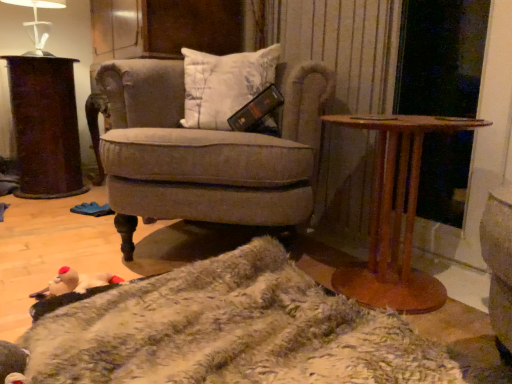
Question: In terms of width, does fuzzy beige blanket at lower center look wider or thinner when compared to dark brown polished wood desk at left?

Choices:
 (A) wide
 (B) thin

Answer: (A)

Question: Is fuzzy beige blanket at lower center in front of or behind dark brown polished wood desk at left in the image?

Choices:
 (A) front
 (B) behind

Answer: (A)

Question: Which of these objects is positioned closest to the velvet beige armchair at center?

Choices:
 (A) fuzzy beige blanket at lower center
 (B) white glossy table lamp at upper left
 (C) brown wood table at right
 (D) white cotton pillow at center
 (E) dark brown polished wood desk at left

Answer: (D)

Question: Estimate the real-world distances between objects in this image. Which object is closer to the white cotton pillow at center?

Choices:
 (A) white glossy table lamp at upper left
 (B) fuzzy beige blanket at lower center
 (C) dark brown polished wood desk at left
 (D) brown wood table at right
 (E) velvet beige armchair at center

Answer: (E)